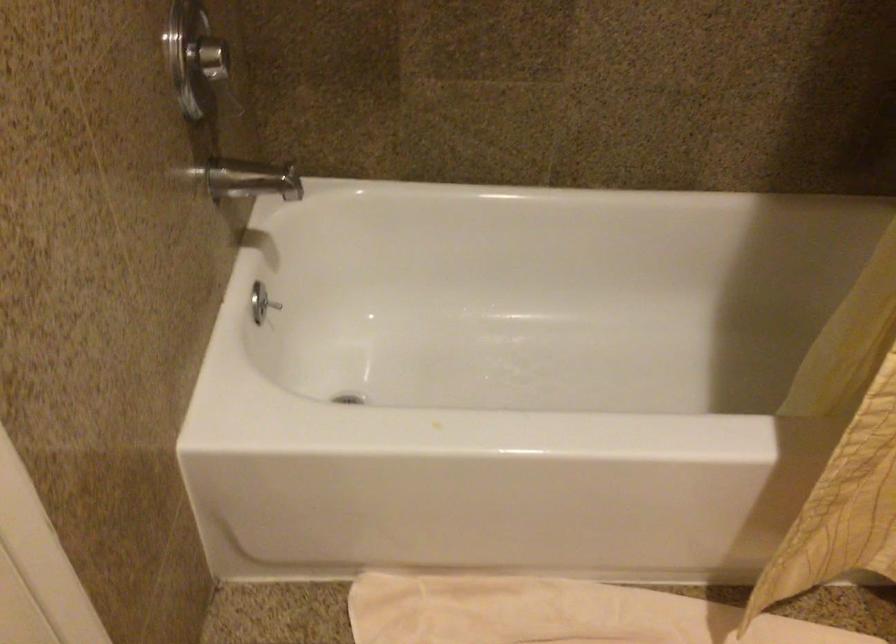
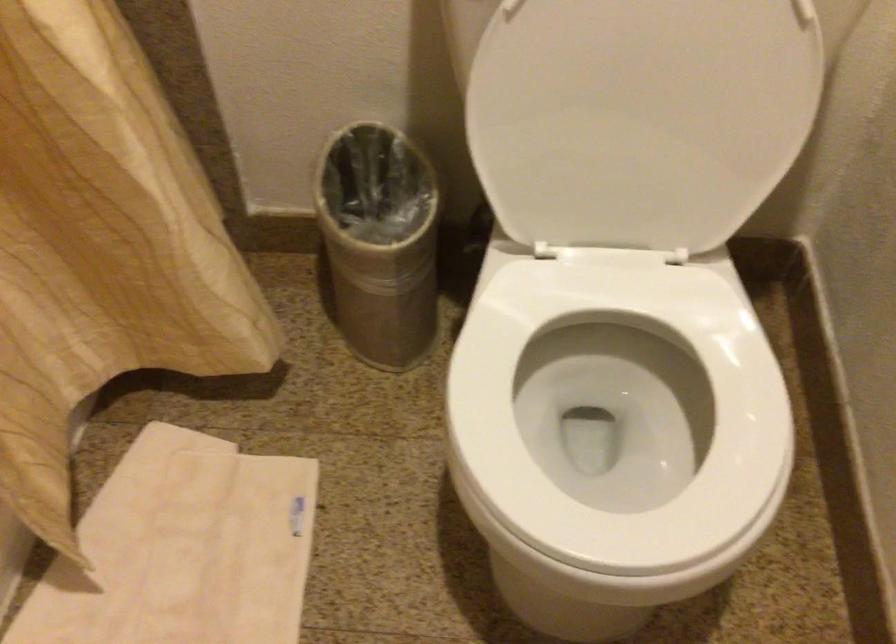
How did the camera likely rotate?

The camera rotated toward right-down.